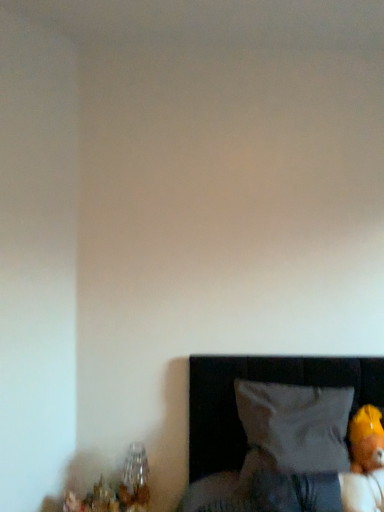
Question: Can you confirm if clear glass vase at lower left is bigger than soft yellow plush bear at lower right?

Choices:
 (A) no
 (B) yes

Answer: (A)

Question: Considering the relative sizes of clear glass vase at lower left and soft yellow plush bear at lower right in the image provided, is clear glass vase at lower left smaller than soft yellow plush bear at lower right?

Choices:
 (A) yes
 (B) no

Answer: (A)

Question: Is clear glass vase at lower left not inside soft yellow plush bear at lower right?

Choices:
 (A) no
 (B) yes

Answer: (B)

Question: Is the surface of clear glass vase at lower left in direct contact with soft yellow plush bear at lower right?

Choices:
 (A) yes
 (B) no

Answer: (B)

Question: From the image's perspective, is clear glass vase at lower left beneath soft yellow plush bear at lower right?

Choices:
 (A) yes
 (B) no

Answer: (A)

Question: Is clear glass vase at lower left inside the boundaries of soft yellow plush bear at lower right, or outside?

Choices:
 (A) inside
 (B) outside

Answer: (B)

Question: Based on their sizes in the image, would you say clear glass vase at lower left is bigger or smaller than soft yellow plush bear at lower right?

Choices:
 (A) small
 (B) big

Answer: (A)

Question: From the image's perspective, is clear glass vase at lower left positioned above or below soft yellow plush bear at lower right?

Choices:
 (A) below
 (B) above

Answer: (A)

Question: Relative to soft yellow plush bear at lower right, is clear glass vase at lower left in front or behind?

Choices:
 (A) behind
 (B) front

Answer: (A)

Question: From a real-world perspective, is soft yellow plush bear at lower right positioned above or below white fabric pillow at lower right?

Choices:
 (A) below
 (B) above

Answer: (A)

Question: Considering the positions of point (360, 410) and point (281, 436), is point (360, 410) closer or farther from the camera than point (281, 436)?

Choices:
 (A) farther
 (B) closer

Answer: (A)

Question: In the image, is soft yellow plush bear at lower right on the left side or the right side of white fabric pillow at lower right?

Choices:
 (A) right
 (B) left

Answer: (A)

Question: Would you say soft yellow plush bear at lower right is inside or outside white fabric pillow at lower right?

Choices:
 (A) outside
 (B) inside

Answer: (B)

Question: Is soft yellow plush bear at lower right taller or shorter than clear glass vase at lower left?

Choices:
 (A) short
 (B) tall

Answer: (B)

Question: Considering the positions of point (357, 478) and point (132, 458), is point (357, 478) closer or farther from the camera than point (132, 458)?

Choices:
 (A) farther
 (B) closer

Answer: (B)